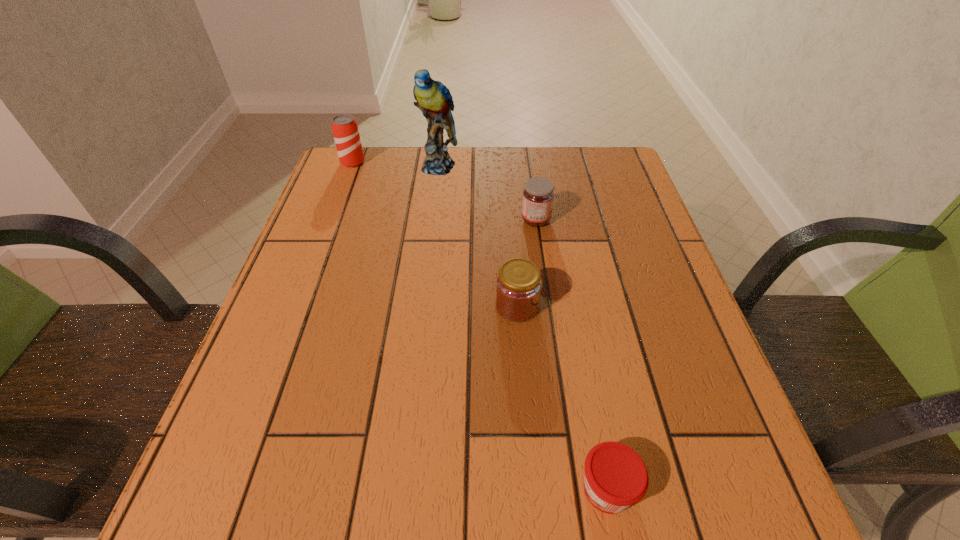
The height and width of the screenshot is (540, 960). What are the coordinates of `parrot` in the screenshot? It's located at (434, 99).

The image size is (960, 540). Identify the location of the tallest object. (434, 99).

At what (x,y) coordinates should I click in order to perform the action: click on the fourth shortest object. Please return your answer as a coordinate pair (x, y). The image size is (960, 540). Looking at the image, I should click on coord(345,130).

In order to click on the leftmost object in this screenshot , I will do `click(345, 130)`.

This screenshot has height=540, width=960. Identify the location of the third farthest object. (538, 195).

Where is `the second nearest object`? the second nearest object is located at coordinates pos(518,288).

At what (x,y) coordinates should I click in order to perform the action: click on the nearest jam. Please return your answer as a coordinate pair (x, y). The image size is (960, 540). Looking at the image, I should click on (616, 477).

The height and width of the screenshot is (540, 960). What are the coordinates of `the nearest object` in the screenshot? It's located at (616, 477).

Identify the location of free space located on the face of the parrot. The height and width of the screenshot is (540, 960). (424, 280).

This screenshot has height=540, width=960. I want to click on vacant space positioned 0.050m on the back of the beer can, so click(x=358, y=147).